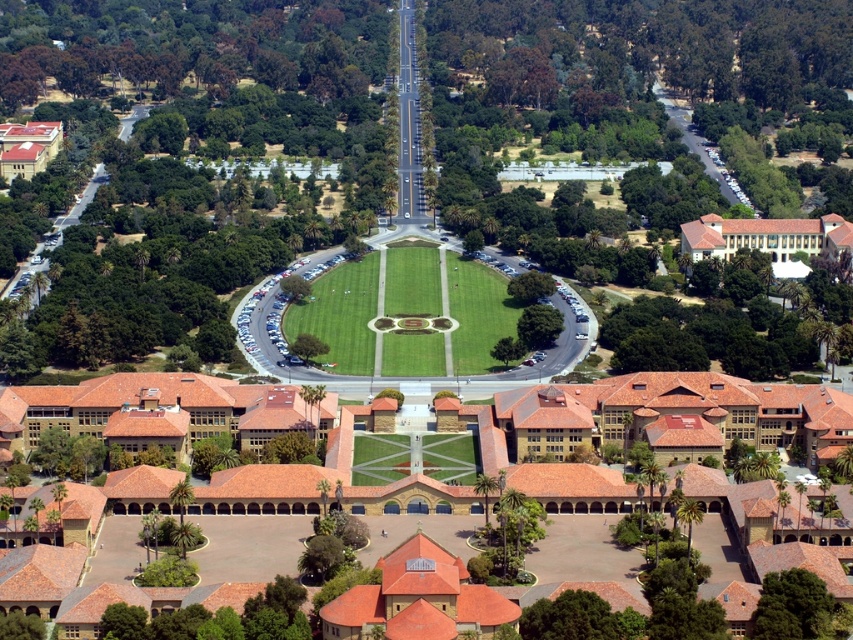
In the scene shown: Which of these two, green grassy field at center or green leafy tree at lower left, stands taller?

With more height is green grassy field at center.

Is point (403, 282) closer to camera compared to point (189, 524)?

No, (403, 282) is behind (189, 524).

Locate an element on the screen. The height and width of the screenshot is (640, 853). green grassy field at center is located at coordinates (341, 314).

Who is higher up, green grassy field at center or green leafy tree at lower right?

green grassy field at center is above.

Who is more distant from viewer, [300,326] or [804,636]?

Point [300,326]

Locate an element on the screen. The height and width of the screenshot is (640, 853). green grassy field at center is located at coordinates (341, 314).

Which is more to the right, green leafy tree at lower right or green leafy tree at center?

From the viewer's perspective, green leafy tree at lower right appears more on the right side.

Where is `green leafy tree at lower right`? This screenshot has height=640, width=853. green leafy tree at lower right is located at coordinates (793, 605).

Between point (788, 616) and point (312, 352), which one is positioned behind?

Positioned behind is point (312, 352).

What are the coordinates of `green leafy tree at lower right` in the screenshot? It's located at (793, 605).